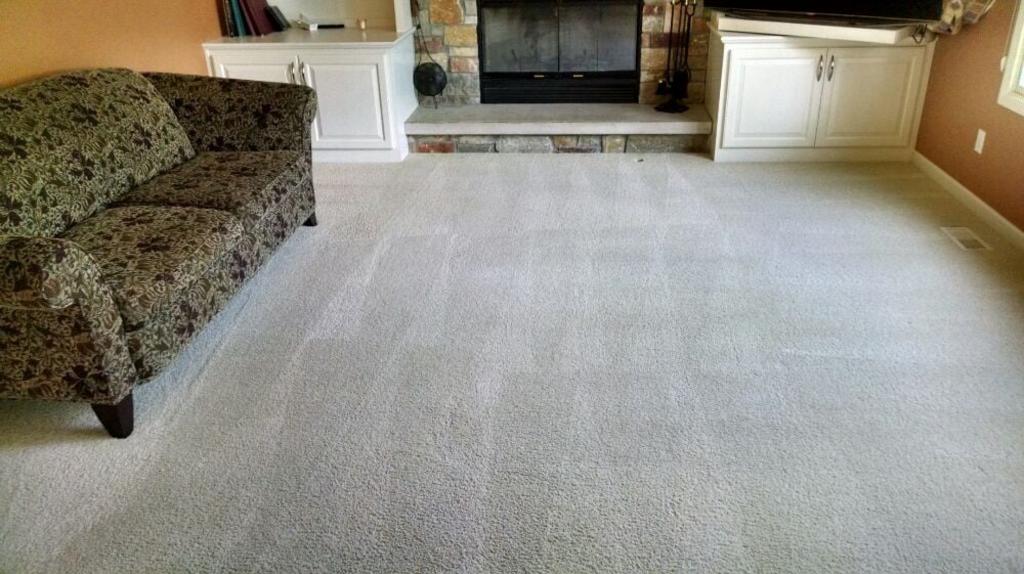
Image resolution: width=1024 pixels, height=574 pixels. Identify the location of book. (239, 20).